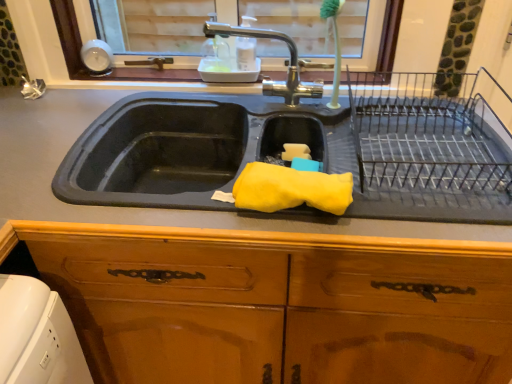
This screenshot has width=512, height=384. What are the coordinates of `yellow sponge at sink` in the screenshot? It's located at (291, 189).

Describe the element at coordinates (430, 134) in the screenshot. Image resolution: width=512 pixels, height=384 pixels. I see `black wire rack at right` at that location.

Locate an element on the screen. This screenshot has height=384, width=512. black wire rack at right is located at coordinates (430, 134).

Locate an element on the screen. The width and height of the screenshot is (512, 384). wooden cabinet at center is located at coordinates (277, 304).

Is wooden cabinet at center completely or partially inside polished chrome faucet at upper center?

Actually, wooden cabinet at center is outside polished chrome faucet at upper center.

The width and height of the screenshot is (512, 384). I want to click on tap above the wooden cabinet at center (from a real-world perspective), so click(288, 66).

Which is in front, point (275, 87) or point (236, 334)?

Point (236, 334)

Locate an element on the screen. This screenshot has width=512, height=384. material in front of the rubber yellow sponge at center is located at coordinates (291, 189).

Between yellow sponge at sink and rubber yellow sponge at center, which one appears on the left side from the viewer's perspective?

Positioned to the left is rubber yellow sponge at center.

From a real-world perspective, which is physically below, yellow sponge at sink or rubber yellow sponge at center?

From a 3D spatial view, rubber yellow sponge at center is below.

Considering the sizes of yellow sponge at sink and rubber yellow sponge at center in the image, is yellow sponge at sink bigger or smaller than rubber yellow sponge at center?

In the image, yellow sponge at sink appears to be smaller than rubber yellow sponge at center.

From a real-world perspective, is polished chrome faucet at upper center beneath yellow sponge at sink?

No.

Is polished chrome faucet at upper center positioned with its back to yellow sponge at sink?

No, polished chrome faucet at upper center's orientation is not away from yellow sponge at sink.

Is polished chrome faucet at upper center not inside yellow sponge at sink?

Yes, polished chrome faucet at upper center is not within yellow sponge at sink.

Which object is closer to the camera taking this photo, wooden cabinet at center or yellow sponge at sink?

wooden cabinet at center is in front.

Find the location of a particular element. The height and width of the screenshot is (384, 512). material that appears above the wooden cabinet at center (from the image's perspective) is located at coordinates (291, 189).

Is wooden cabinet at center not within yellow sponge at sink?

That's correct, wooden cabinet at center is outside of yellow sponge at sink.

Is rubber yellow sponge at center shorter than yellow sponge at sink?

No, rubber yellow sponge at center is not shorter than yellow sponge at sink.

Between point (34, 154) and point (351, 198), which one is positioned in front?

The point (351, 198) is in front.

Between rubber yellow sponge at center and yellow sponge at sink, which one has larger width?

Wider between the two is rubber yellow sponge at center.

Between black wire rack at right and rubber yellow sponge at center, which one appears on the left side from the viewer's perspective?

rubber yellow sponge at center.

Is black wire rack at right located outside rubber yellow sponge at center?

Absolutely, black wire rack at right is external to rubber yellow sponge at center.

Who is bigger, black wire rack at right or rubber yellow sponge at center?

With larger size is rubber yellow sponge at center.

From the picture: From the image's perspective, is black wire rack at right above or below rubber yellow sponge at center?

Based on their image positions, black wire rack at right is located above rubber yellow sponge at center.

Is polished chrome faucet at upper center facing towards black wire rack at right?

No, polished chrome faucet at upper center is not aimed at black wire rack at right.

From the image's perspective, is polished chrome faucet at upper center located beneath black wire rack at right?

No, from the image's perspective, polished chrome faucet at upper center is not below black wire rack at right.

From a real-world perspective, is polished chrome faucet at upper center located higher than black wire rack at right?

Yes, from a real-world perspective, polished chrome faucet at upper center is above black wire rack at right.

How far apart are polished chrome faucet at upper center and black wire rack at right?

polished chrome faucet at upper center and black wire rack at right are 26.19 centimeters apart from each other.

Identify the location of tap behind the wooden cabinet at center. (288, 66).

Find the location of a particular element. This screenshot has width=512, height=384. material that is above the rubber yellow sponge at center (from a real-world perspective) is located at coordinates (291, 189).

When comparing their distances from polished chrome faucet at upper center, does black wire rack at right or rubber yellow sponge at center seem closer?

black wire rack at right.

Estimate the real-world distances between objects in this image. Which object is closer to black wire rack at right, polished chrome faucet at upper center or wooden cabinet at center?

polished chrome faucet at upper center is positioned closer to the anchor black wire rack at right.

Based on the photo, looking at the image, which one is located further to wooden cabinet at center, rubber yellow sponge at center or polished chrome faucet at upper center?

The object further to wooden cabinet at center is polished chrome faucet at upper center.

When comparing their distances from yellow sponge at sink, does wooden cabinet at center or rubber yellow sponge at center seem further?

The object further to yellow sponge at sink is wooden cabinet at center.

Considering their positions, is yellow sponge at sink positioned closer to polished chrome faucet at upper center than black wire rack at right?

black wire rack at right is closer to polished chrome faucet at upper center.

When comparing their distances from polished chrome faucet at upper center, does rubber yellow sponge at center or yellow sponge at sink seem closer?

The object closer to polished chrome faucet at upper center is yellow sponge at sink.

Which object lies nearer to the anchor point rubber yellow sponge at center, polished chrome faucet at upper center or black wire rack at right?

The object closer to rubber yellow sponge at center is black wire rack at right.

Looking at the image, which one is located closer to polished chrome faucet at upper center, yellow sponge at sink or wooden cabinet at center?

The object closer to polished chrome faucet at upper center is yellow sponge at sink.

Identify the location of countertop between polished chrome faucet at upper center and wooden cabinet at center vertically. This screenshot has height=384, width=512. (142, 208).

I want to click on countertop between polished chrome faucet at upper center and yellow sponge at sink in the up-down direction, so click(142, 208).

This screenshot has height=384, width=512. I want to click on cage between polished chrome faucet at upper center and wooden cabinet at center in the vertical direction, so click(430, 134).

Identify the location of material between wooden cabinet at center and black wire rack at right. Image resolution: width=512 pixels, height=384 pixels. (291, 189).